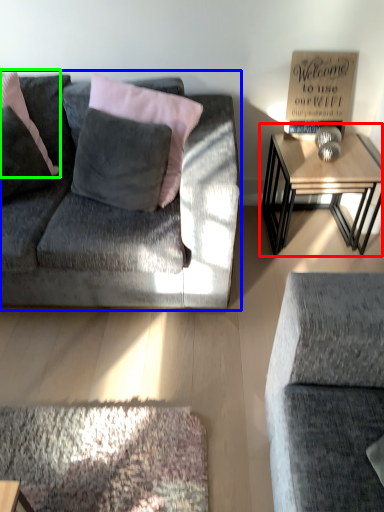
Question: Based on their relative distances, which object is nearer to table (highlighted by a red box)? Choose from studio couch (highlighted by a blue box) and pillow (highlighted by a green box).

Choices:
 (A) studio couch
 (B) pillow

Answer: (A)